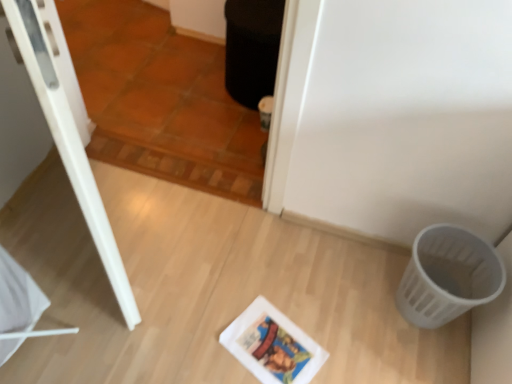
Question: From the image's perspective, is white plastic basket at lower right over brown terracotta tile at upper center?

Choices:
 (A) yes
 (B) no

Answer: (B)

Question: Is white plastic basket at lower right behind brown terracotta tile at upper center?

Choices:
 (A) yes
 (B) no

Answer: (A)

Question: Is white plastic basket at lower right positioned beyond the bounds of brown terracotta tile at upper center?

Choices:
 (A) yes
 (B) no

Answer: (A)

Question: Is white plastic basket at lower right at the right side of brown terracotta tile at upper center?

Choices:
 (A) yes
 (B) no

Answer: (A)

Question: Can you confirm if white plastic basket at lower right is shorter than brown terracotta tile at upper center?

Choices:
 (A) yes
 (B) no

Answer: (A)

Question: Is matte white comic book at center wider or thinner than brown terracotta tile at upper center?

Choices:
 (A) thin
 (B) wide

Answer: (B)

Question: From the image's perspective, is matte white comic book at center located above or below brown terracotta tile at upper center?

Choices:
 (A) above
 (B) below

Answer: (B)

Question: Would you say matte white comic book at center is to the left or to the right of brown terracotta tile at upper center in the picture?

Choices:
 (A) right
 (B) left

Answer: (A)

Question: In the image, is matte white comic book at center positioned in front of or behind brown terracotta tile at upper center?

Choices:
 (A) front
 (B) behind

Answer: (B)

Question: Choose the correct answer: Is white plastic basket at lower right inside matte white comic book at center or outside it?

Choices:
 (A) inside
 (B) outside

Answer: (B)

Question: Based on their sizes in the image, would you say white plastic basket at lower right is bigger or smaller than matte white comic book at center?

Choices:
 (A) big
 (B) small

Answer: (A)

Question: From the image's perspective, is white plastic basket at lower right located above or below matte white comic book at center?

Choices:
 (A) below
 (B) above

Answer: (B)

Question: Considering their positions, is white plastic basket at lower right located in front of or behind matte white comic book at center?

Choices:
 (A) front
 (B) behind

Answer: (A)

Question: Is brown terracotta tile at upper center to the left or to the right of matte white comic book at center in the image?

Choices:
 (A) right
 (B) left

Answer: (B)

Question: In the image, is brown terracotta tile at upper center positioned in front of or behind matte white comic book at center?

Choices:
 (A) behind
 (B) front

Answer: (B)